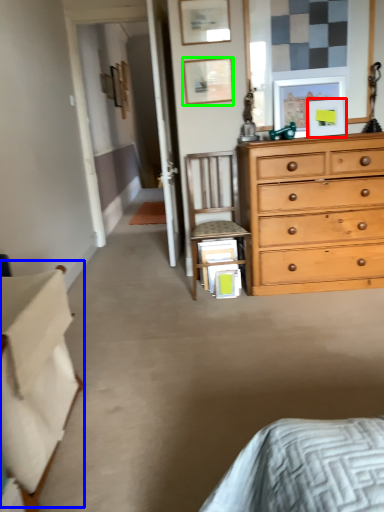
Question: Which object is positioned closest to picture frame (highlighted by a red box)? Select from table (highlighted by a blue box) and picture frame (highlighted by a green box).

Choices:
 (A) table
 (B) picture frame

Answer: (B)